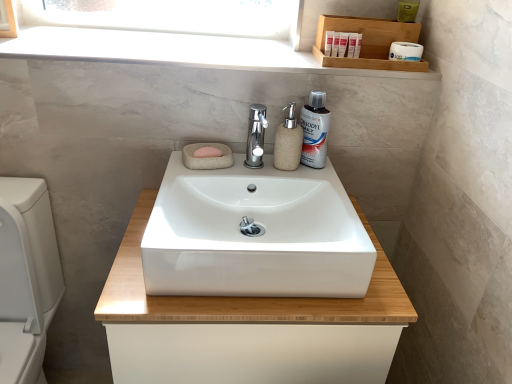
The image size is (512, 384). In order to click on vacant space to the left of white plastic tubes at upper center, placed as the third toiletry when sorted from right to left in this screenshot , I will do `click(289, 57)`.